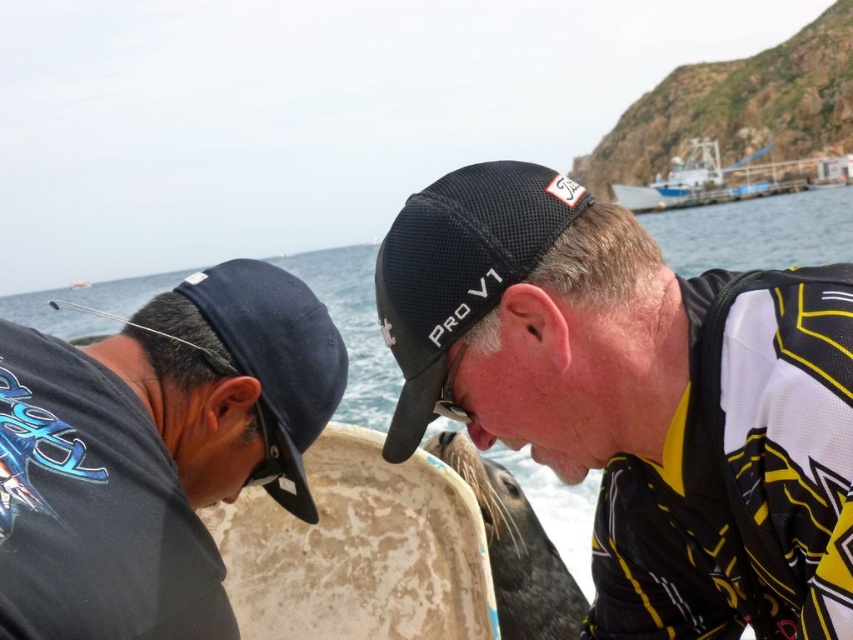
Does black matte baseball cap at left have a lesser width compared to blue matte boat at upper right?

Yes, black matte baseball cap at left is thinner than blue matte boat at upper right.

Who is lower down, black matte baseball cap at left or blue matte boat at upper right?

Positioned lower is black matte baseball cap at left.

Does point (64, 515) come farther from viewer compared to point (705, 173)?

No, (64, 515) is in front of (705, 173).

At what (x,y) coordinates should I click in order to perform the action: click on black matte baseball cap at left. Please return your answer as a coordinate pair (x, y). This screenshot has width=853, height=640. Looking at the image, I should click on (154, 452).

Does black mesh cap at upper center have a lesser width compared to black matte baseball cap at left?

In fact, black mesh cap at upper center might be wider than black matte baseball cap at left.

Who is higher up, black mesh cap at upper center or black matte baseball cap at left?

black mesh cap at upper center is above.

Is point (482, 332) closer to viewer compared to point (108, 364)?

No, (482, 332) is behind (108, 364).

Locate an element on the screen. The width and height of the screenshot is (853, 640). black mesh cap at upper center is located at coordinates (569, 378).

Who is positioned more to the left, yellow/black mesh wetsuit at center or navy blue fabric baseball cap at left?

Positioned to the left is navy blue fabric baseball cap at left.

Consider the image. Measure the distance from yellow/black mesh wetsuit at center to navy blue fabric baseball cap at left.

yellow/black mesh wetsuit at center is 28.32 feet away from navy blue fabric baseball cap at left.

This screenshot has width=853, height=640. Identify the location of yellow/black mesh wetsuit at center. (740, 474).